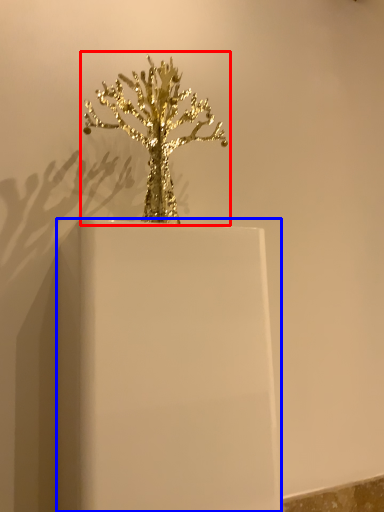
Question: Among these objects, which one is farthest to the camera, houseplant (highlighted by a red box) or candle holder (highlighted by a blue box)?

Choices:
 (A) houseplant
 (B) candle holder

Answer: (A)